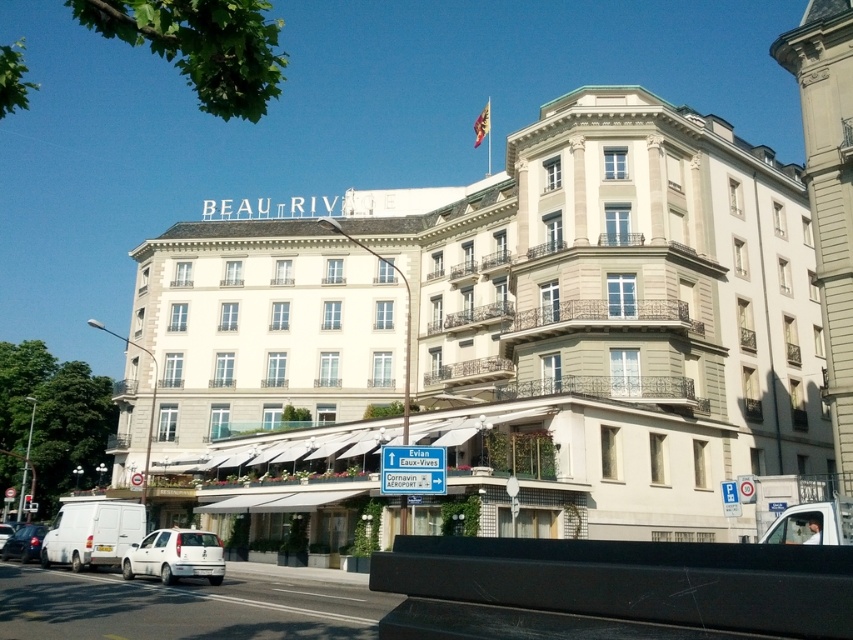
Is white stone building at center shorter than white matte van at lower left?

No.

Can you confirm if white stone building at center is wider than white matte van at lower left?

Correct, the width of white stone building at center exceeds that of white matte van at lower left.

Based on the photo, measure the distance between point (352,426) and camera.

They are 73.07 meters apart.

Find the location of a particular element. Image resolution: width=853 pixels, height=640 pixels. white stone building at center is located at coordinates (509, 333).

Which is above, white matte van at lower left or white matte van at lower right?

white matte van at lower right

Is white matte van at lower left above white matte van at lower right?

Incorrect, white matte van at lower left is not positioned above white matte van at lower right.

I want to click on white matte van at lower left, so click(x=175, y=556).

Consider the image. Does white matte van at lower right appear on the right side of white matte car at lower left?

Correct, you'll find white matte van at lower right to the right of white matte car at lower left.

Is white matte van at lower right bigger than white matte car at lower left?

Indeed, white matte van at lower right has a larger size compared to white matte car at lower left.

Does point (798, 518) lie in front of point (6, 529)?

That is True.

Locate an element on the screen. Image resolution: width=853 pixels, height=640 pixels. white matte van at lower right is located at coordinates (811, 524).